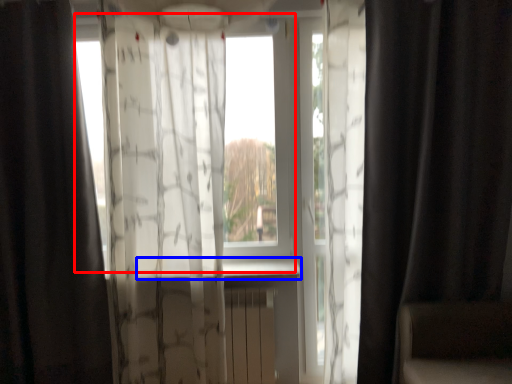
Question: Which object is further to the camera taking this photo, window screen (highlighted by a red box) or window sill (highlighted by a blue box)?

Choices:
 (A) window screen
 (B) window sill

Answer: (A)